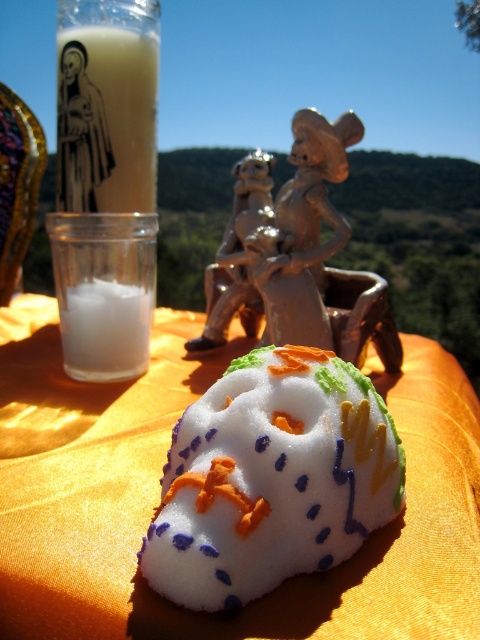
Who is positioned more to the right, orange satin tablecloth at lower center or white opaque liquid at left?

orange satin tablecloth at lower center is more to the right.

Between point (304, 596) and point (121, 362), which one is positioned in front?

Positioned in front is point (304, 596).

Find the location of a particular element. orange satin tablecloth at lower center is located at coordinates (158, 493).

Is orange satin tablecloth at lower center closer to camera compared to white sugar skull at center?

Yes, it is.

The image size is (480, 640). What do you see at coordinates (158, 493) in the screenshot?
I see `orange satin tablecloth at lower center` at bounding box center [158, 493].

Is point (212, 634) positioned behind point (230, 369)?

No, it is in front of (230, 369).

The image size is (480, 640). I want to click on orange satin tablecloth at lower center, so click(x=158, y=493).

Who is more forward, (109, 620) or (302, 131)?

Point (109, 620) is in front.

Between point (431, 636) and point (334, 308), which one is positioned behind?

The point (334, 308) is behind.

Which is in front, point (433, 470) or point (225, 241)?

Point (433, 470) is in front.

Where is `orange satin tablecloth at lower center`? The width and height of the screenshot is (480, 640). orange satin tablecloth at lower center is located at coordinates (158, 493).